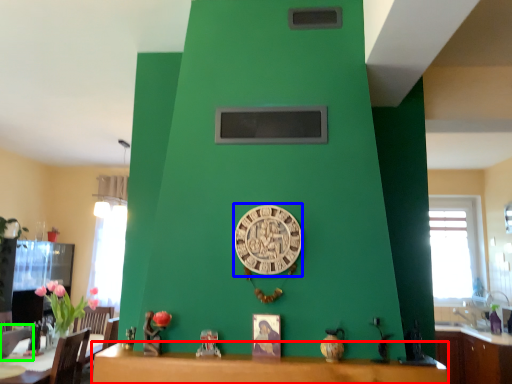
Question: Which object is positioned closest to table (highlighted by a red box)? Select from clock (highlighted by a blue box) and armchair (highlighted by a green box).

Choices:
 (A) clock
 (B) armchair

Answer: (A)